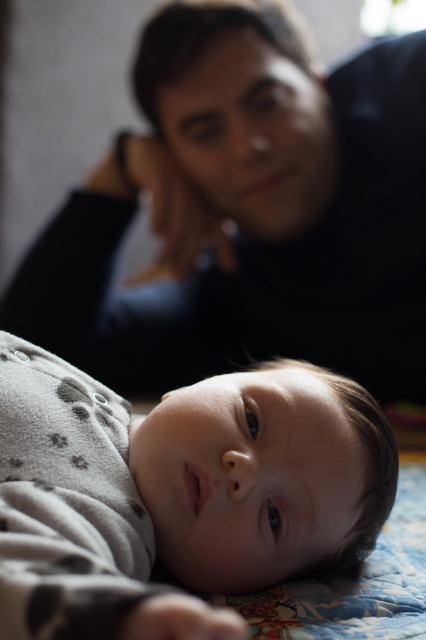
Between black matte shirt at upper center and gray dotted fabric at lower center, which one appears on the left side from the viewer's perspective?

gray dotted fabric at lower center

Is black matte shirt at upper center to the left of gray dotted fabric at lower center from the viewer's perspective?

Incorrect, black matte shirt at upper center is not on the left side of gray dotted fabric at lower center.

Which is behind, point (144, 166) or point (307, 452)?

Positioned behind is point (144, 166).

This screenshot has height=640, width=426. What are the coordinates of `black matte shirt at upper center` in the screenshot? It's located at (247, 212).